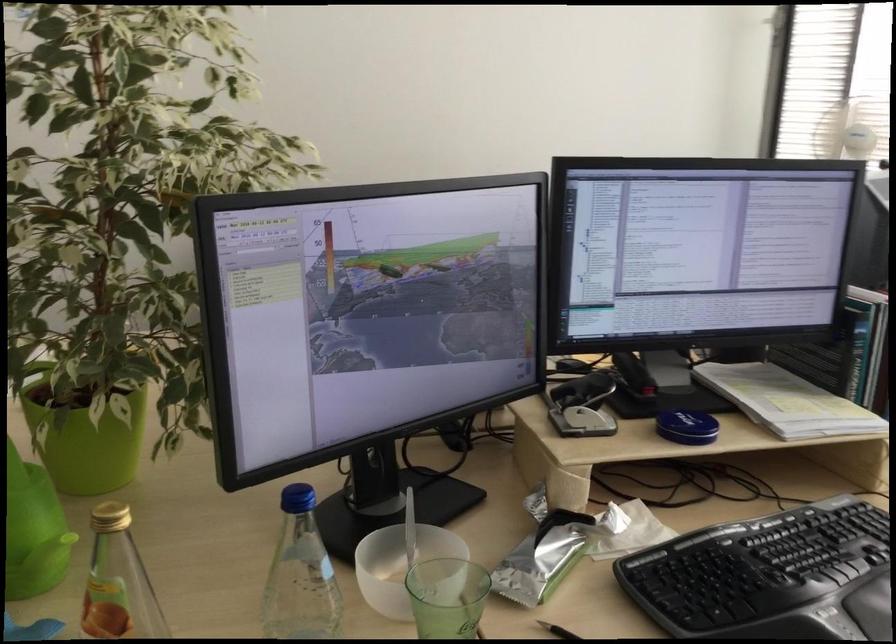
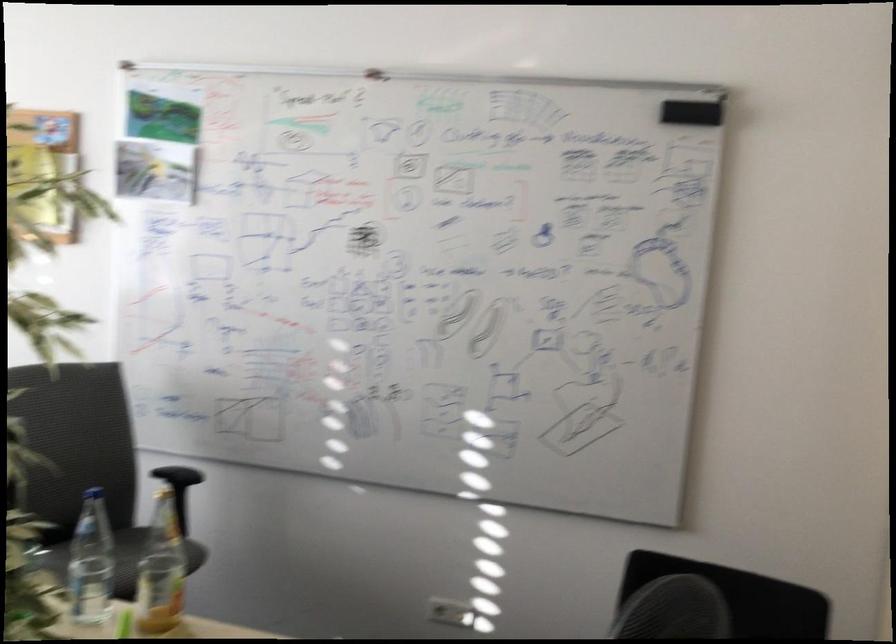
Question: I am providing you with two images of the same scene from different viewpoints. Please identify which objects are invisible in image2.

Choices:
 (A) white intercom button
 (B) grey chair sitting surface
 (C) clear water bottle
 (D) blue bottle cap

Answer: (D)